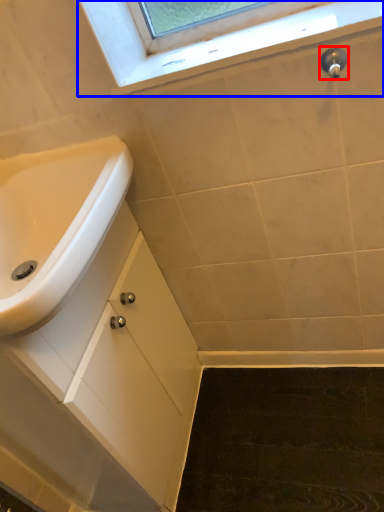
Question: Which object is further to the camera taking this photo, plumbing fixture (highlighted by a red box) or window (highlighted by a blue box)?

Choices:
 (A) plumbing fixture
 (B) window

Answer: (A)